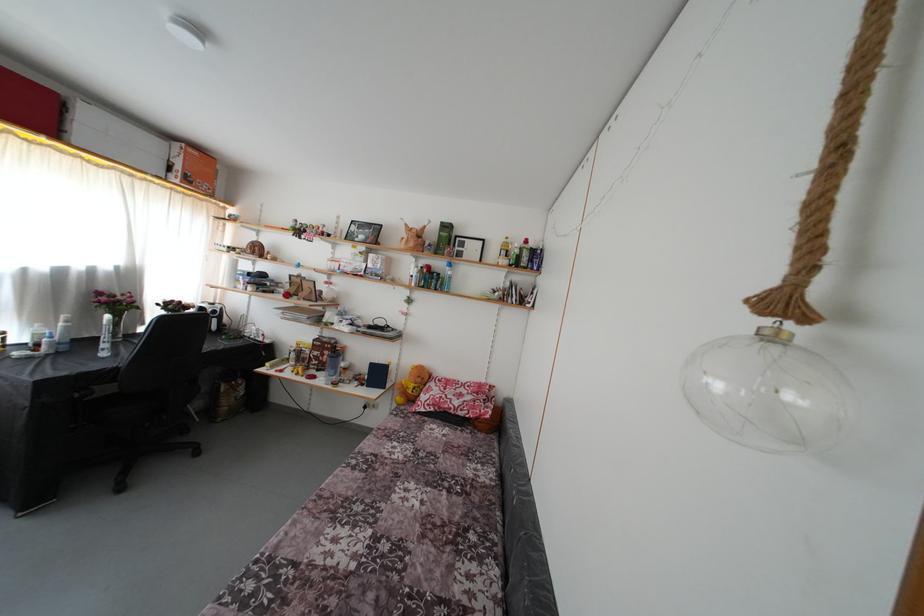
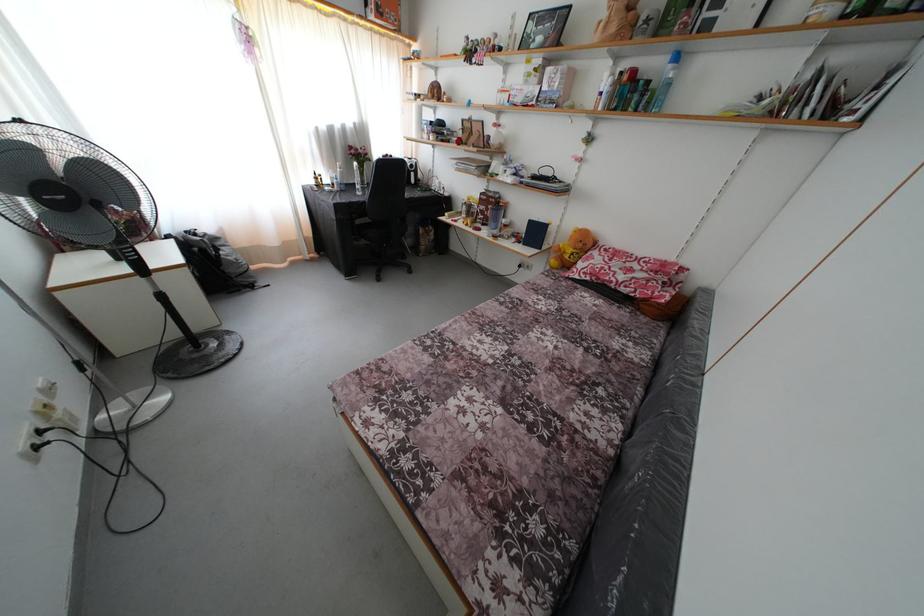
Find the pixel in the second image that matches (400,421) in the first image.

(552, 282)